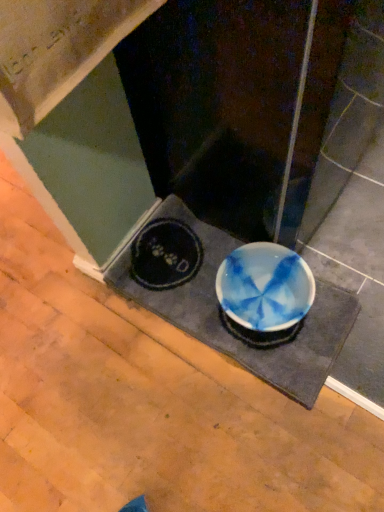
The image size is (384, 512). I want to click on free location to the right of blue glossy bowl at center, so click(x=342, y=245).